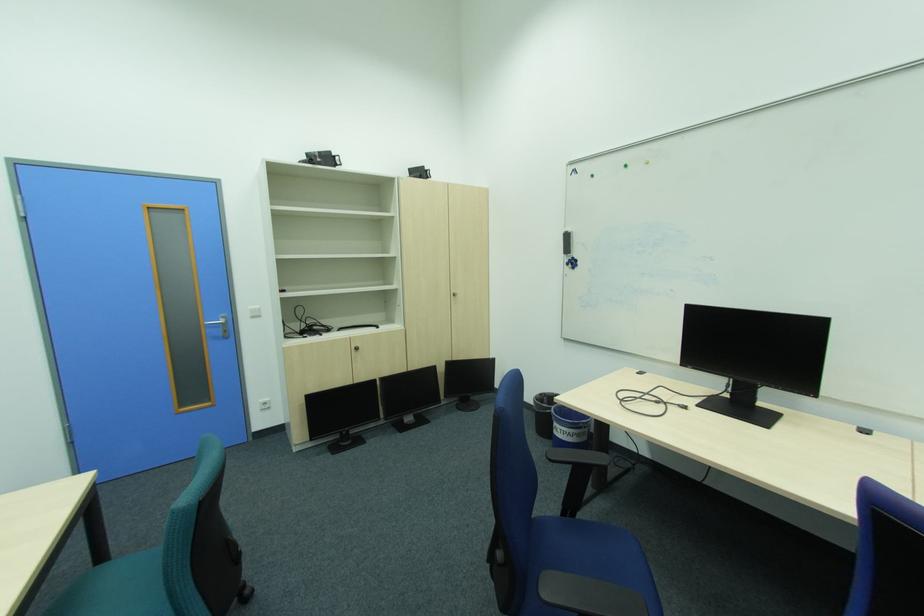
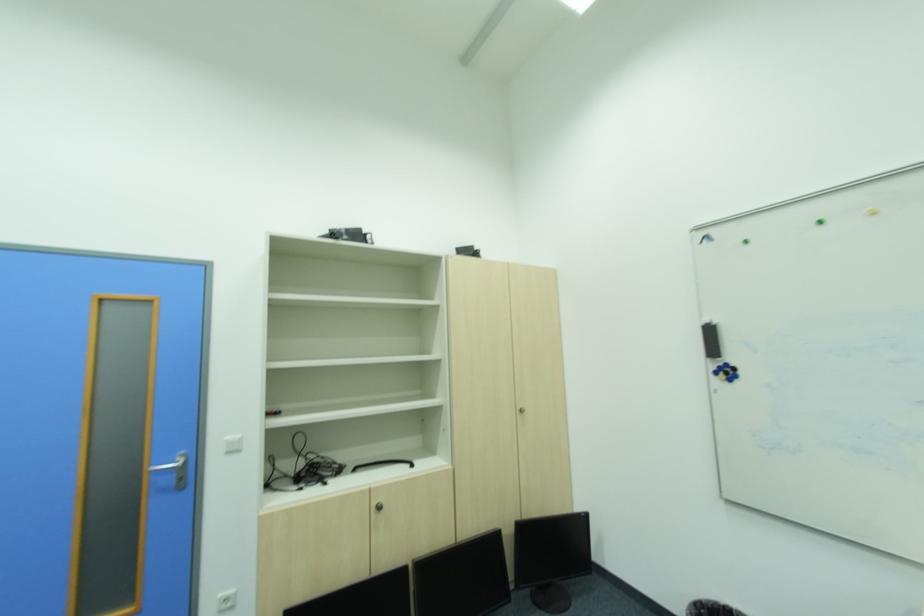
Find the pixel in the second image that matches point 382,381 in the first image.

(411, 570)